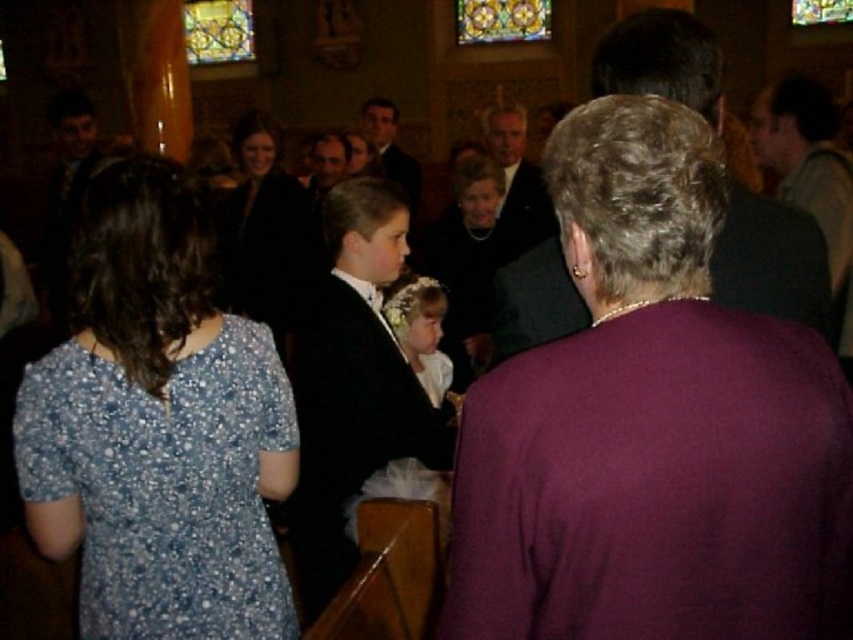
Question: Does blue dotted fabric dress at lower left appear on the left side of gray wool sweater at upper right?

Choices:
 (A) yes
 (B) no

Answer: (A)

Question: Which of the following is the closest to the observer?

Choices:
 (A) (296, 252)
 (B) (732, 314)
 (C) (519, 205)

Answer: (B)

Question: Among these objects, which one is farthest from the camera?

Choices:
 (A) pearl necklace at center
 (B) formal suit at center

Answer: (B)

Question: Which is nearer to the matte black suit at center?

Choices:
 (A) pearl necklace at center
 (B) formal black suit at center
 (C) purple fabric at center
 (D) gray wool sweater at upper right

Answer: (A)

Question: Is formal suit at center positioned before matte black suit at center?

Choices:
 (A) no
 (B) yes

Answer: (A)

Question: Where is formal suit at center located in relation to matte black suit at center in the image?

Choices:
 (A) above
 (B) below

Answer: (A)